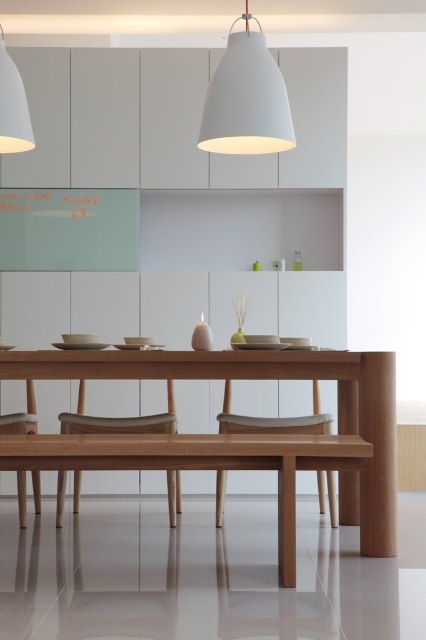
Does point (150, 432) come behind point (5, 128)?

Yes, point (150, 432) is behind point (5, 128).

Who is higher up, light brown wood chair at center or matte white pendant lamp at upper center?

matte white pendant lamp at upper center is higher up.

Which is in front, point (74, 486) or point (5, 96)?

Point (5, 96) is in front.

Identify the location of light brown wood chair at center. The width and height of the screenshot is (426, 640). (117, 422).

Who is lower down, light brown wood chair at center or light brown wooden chair at center?

light brown wood chair at center is lower down.

Between point (141, 428) and point (328, 420), which one is positioned behind?

The point (328, 420) is more distant.

Describe the element at coordinates (117, 422) in the screenshot. I see `light brown wood chair at center` at that location.

Identify the location of light brown wood chair at center. This screenshot has height=640, width=426. (117, 422).

Can you confirm if white matte pendant light at upper center is smaller than light brown wooden chair at lower left?

Actually, white matte pendant light at upper center might be larger than light brown wooden chair at lower left.

Which is more to the right, white matte pendant light at upper center or light brown wooden chair at lower left?

white matte pendant light at upper center

Is point (247, 136) positioned in front of point (34, 499)?

Yes, point (247, 136) is in front of point (34, 499).

Find the location of a particular element. white matte pendant light at upper center is located at coordinates (245, 99).